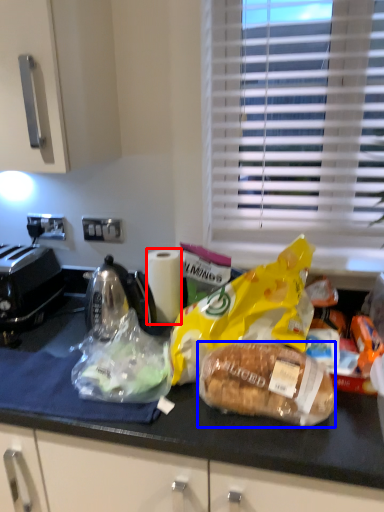
Question: Which object is closer to the camera taking this photo, paper towel (highlighted by a red box) or bread (highlighted by a blue box)?

Choices:
 (A) paper towel
 (B) bread

Answer: (B)